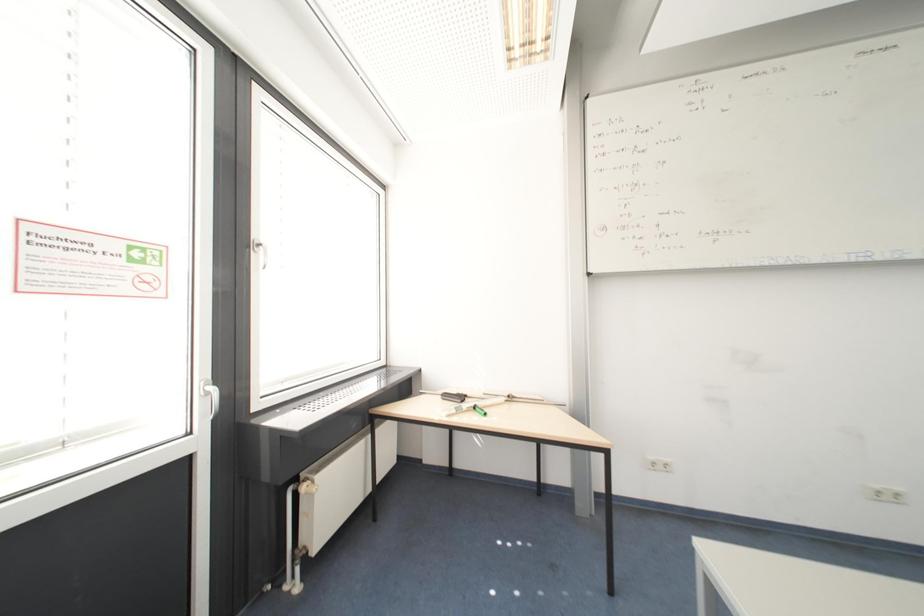
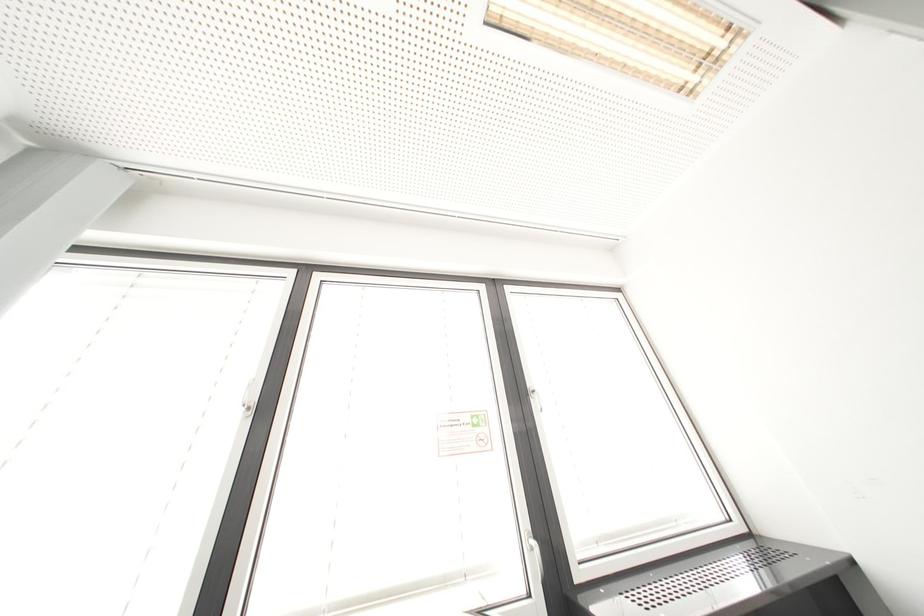
The first image is from the beginning of the video and the second image is from the end. How did the camera likely rotate when shooting the video?

The rotation direction of the camera is left-up.